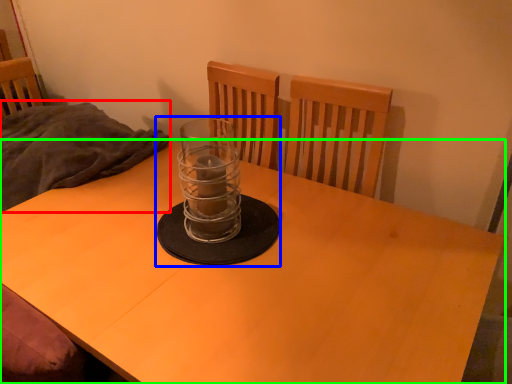
Question: Which is farther away from blanket (highlighted by a red box)? candle holder (highlighted by a blue box) or desk (highlighted by a green box)?

Choices:
 (A) candle holder
 (B) desk

Answer: (A)